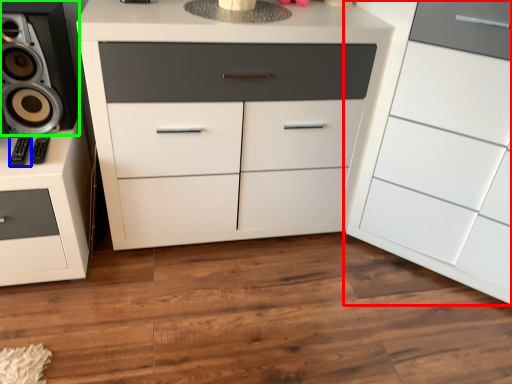
Question: Considering the real-world distances, which object is closest to chest of drawers (highlighted by a red box)? audio (highlighted by a blue box) or speaker (highlighted by a green box).

Choices:
 (A) audio
 (B) speaker

Answer: (B)